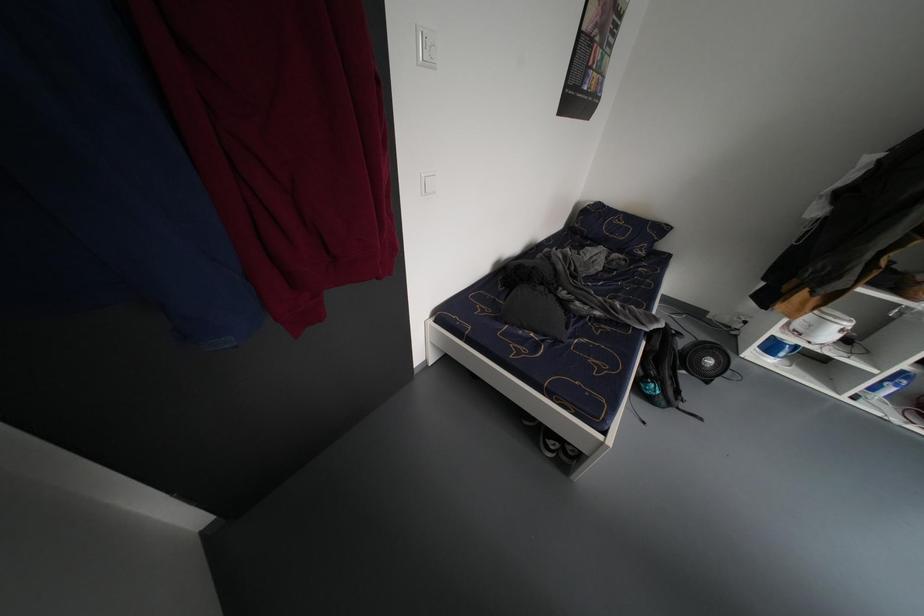
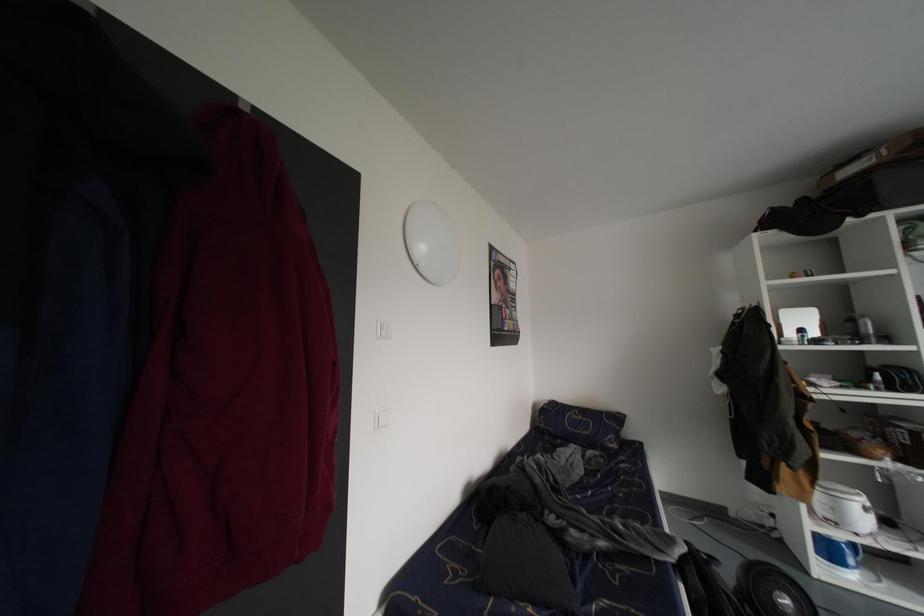
Question: Based on the continuous images, in which direction is the camera rotating? Reply with the corresponding letter.

Choices:
 (A) Left
 (B) Right
 (C) Up
 (D) Down

Answer: (C)